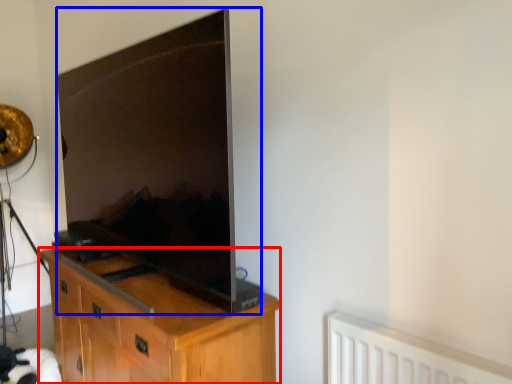
Question: Which of the following is the closest to the observer, cabinetry (highlighted by a red box) or television (highlighted by a blue box)?

Choices:
 (A) cabinetry
 (B) television

Answer: (B)